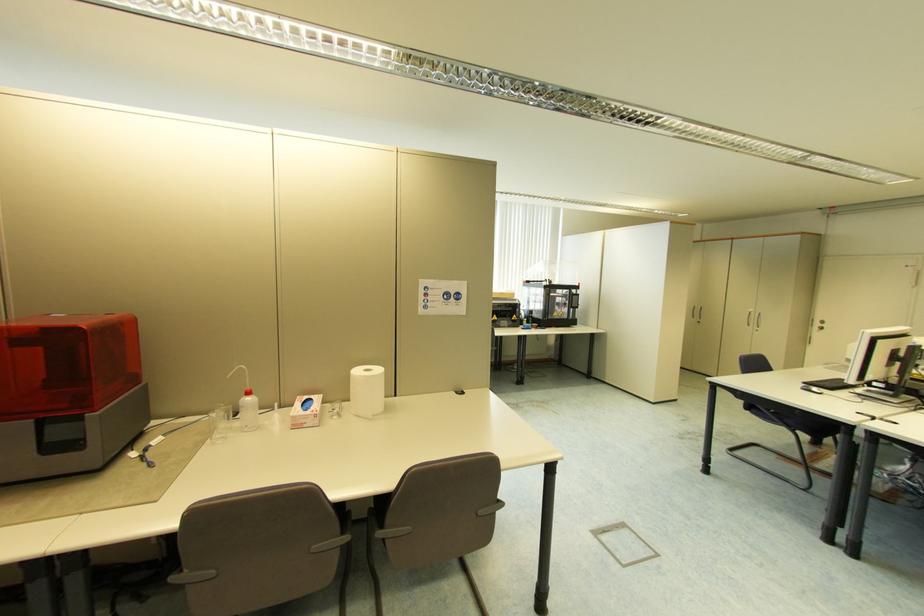
You are a GUI agent. You are given a task and a screenshot of the screen. Output one action in this format:
    pyautogui.click(x=<x>, y=<y>)
    Task: Click on the glass beaker
    This screenshot has height=616, width=924.
    Given the screenshot: What is the action you would take?
    pyautogui.click(x=220, y=422)